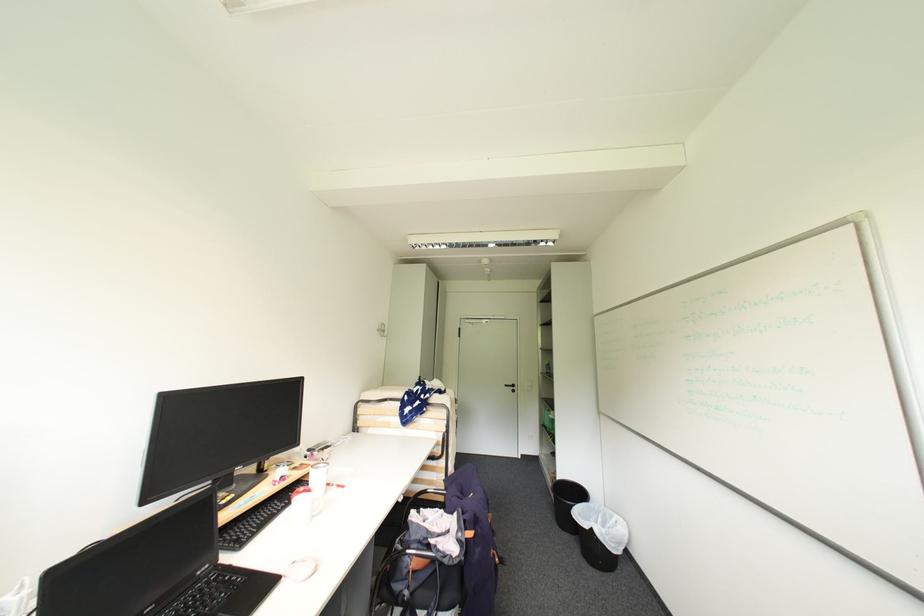
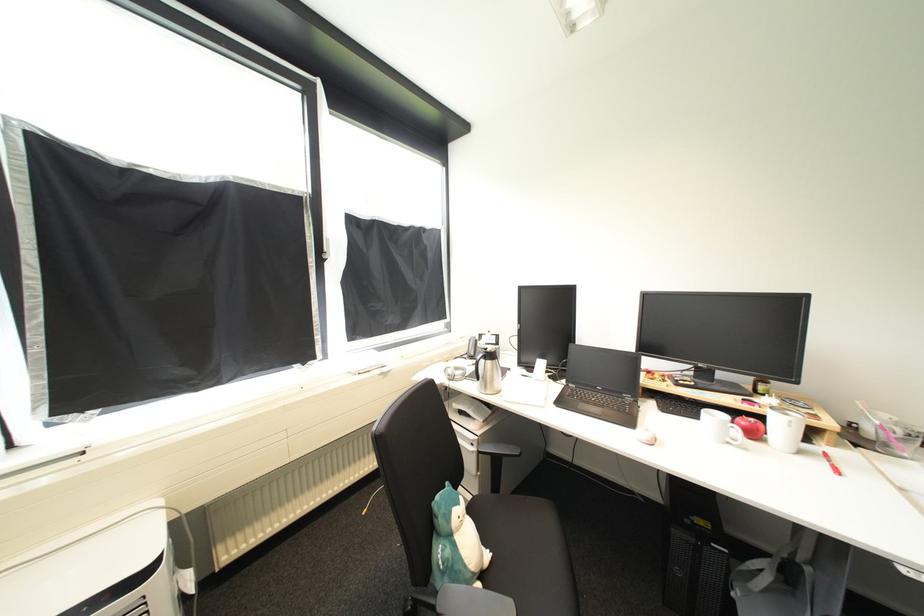
Locate, in the second image, the point that corresponds to (x=341, y=488) in the first image.

(834, 464)